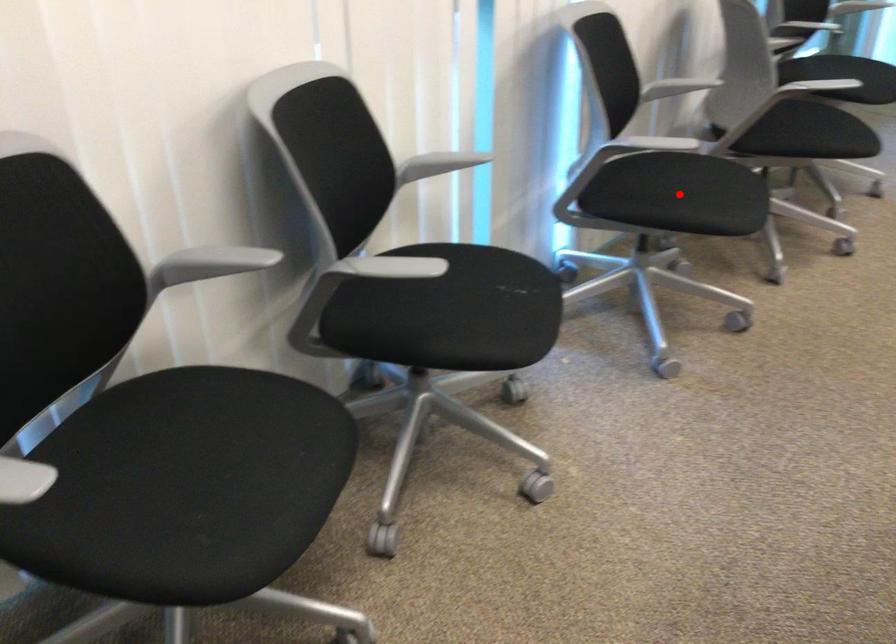
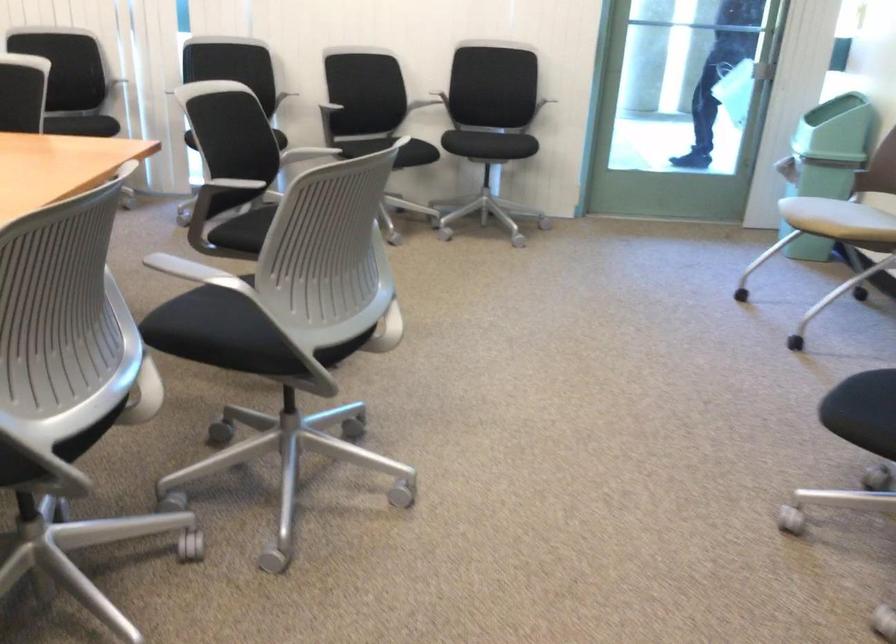
Question: I am providing you with two images of the same scene from different viewpoints. A red point is marked on the first image. Is the red point's position out of view in image 2?

Choices:
 (A) Yes
 (B) No

Answer: (A)